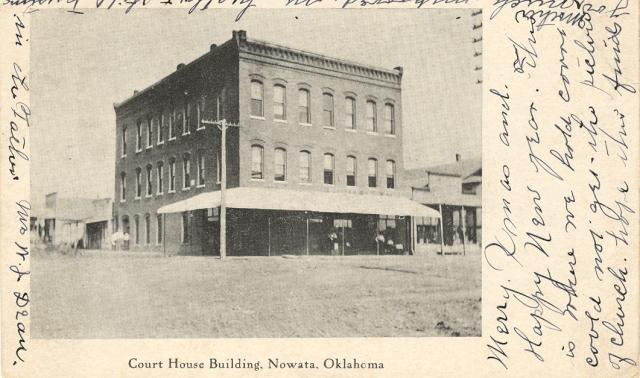
Locate an element on the screen. The height and width of the screenshot is (378, 640). trash is located at coordinates (116, 238).